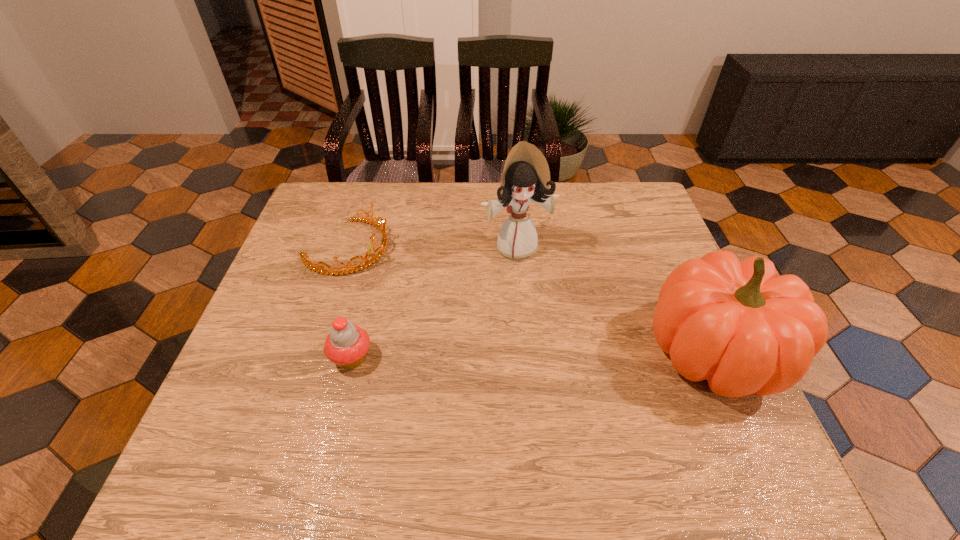
Image resolution: width=960 pixels, height=540 pixels. Find the location of `free space on the desktop that is between the cupcake and the rightmost object and is positioned at the front face of the doll`. free space on the desktop that is between the cupcake and the rightmost object and is positioned at the front face of the doll is located at coordinates 558,354.

Locate an element on the screen. The height and width of the screenshot is (540, 960). vacant space on the desktop that is between the cupcake and the rightmost object and is positioned on the front-facing side of the tiara is located at coordinates (559, 354).